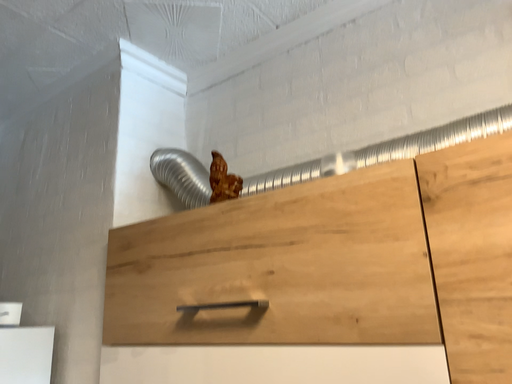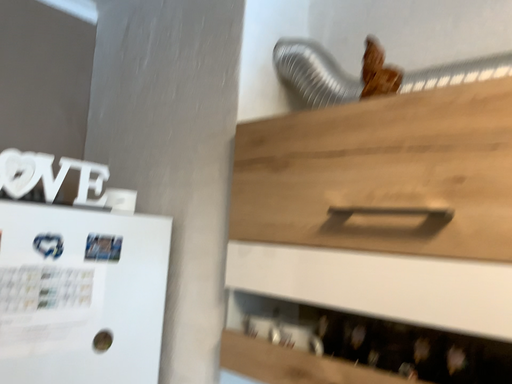
Question: How did the camera likely rotate when shooting the video?

Choices:
 (A) rotated downward
 (B) rotated upward

Answer: (A)